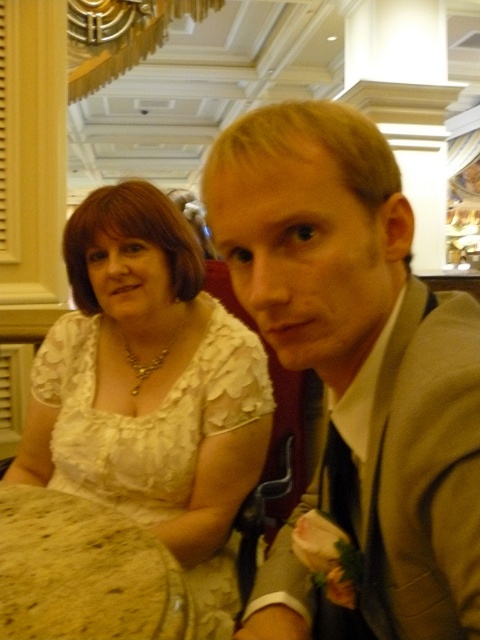
Describe the element at coordinates (356, 378) in the screenshot. This screenshot has height=640, width=480. I see `satin beige suit at right` at that location.

Does satin beige suit at right have a smaller size compared to white lace dress at left?

Yes, satin beige suit at right is smaller than white lace dress at left.

Locate an element on the screen. satin beige suit at right is located at coordinates (356, 378).

Is point (156, 506) positioned before point (69, 627)?

No, it is behind (69, 627).

Is white lace dress at left positioned before brown speckled stone table at lower left?

No.

Between point (66, 353) and point (12, 516), which one is positioned behind?

Point (66, 353)

What are the coordinates of `white lace dress at left` in the screenshot? It's located at (146, 413).

Image resolution: width=480 pixels, height=640 pixels. What do you see at coordinates (356, 378) in the screenshot?
I see `satin beige suit at right` at bounding box center [356, 378].

Which of these two, satin beige suit at right or brown speckled stone table at lower left, stands shorter?

With less height is brown speckled stone table at lower left.

Is point (228, 243) positioned before point (179, 582)?

Yes, point (228, 243) is closer to viewer.

The height and width of the screenshot is (640, 480). Identify the location of satin beige suit at right. (356, 378).